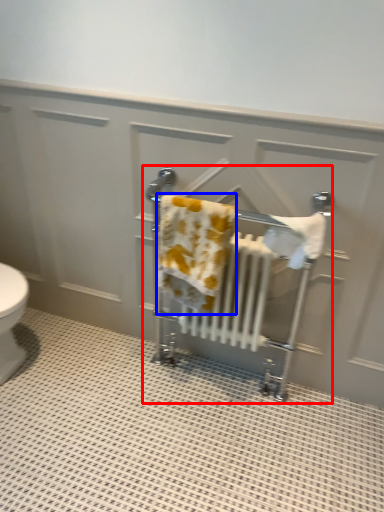
Question: Which point is closer to the camera, baby carriage (highlighted by a red box) or bath towel (highlighted by a blue box)?

Choices:
 (A) baby carriage
 (B) bath towel

Answer: (B)